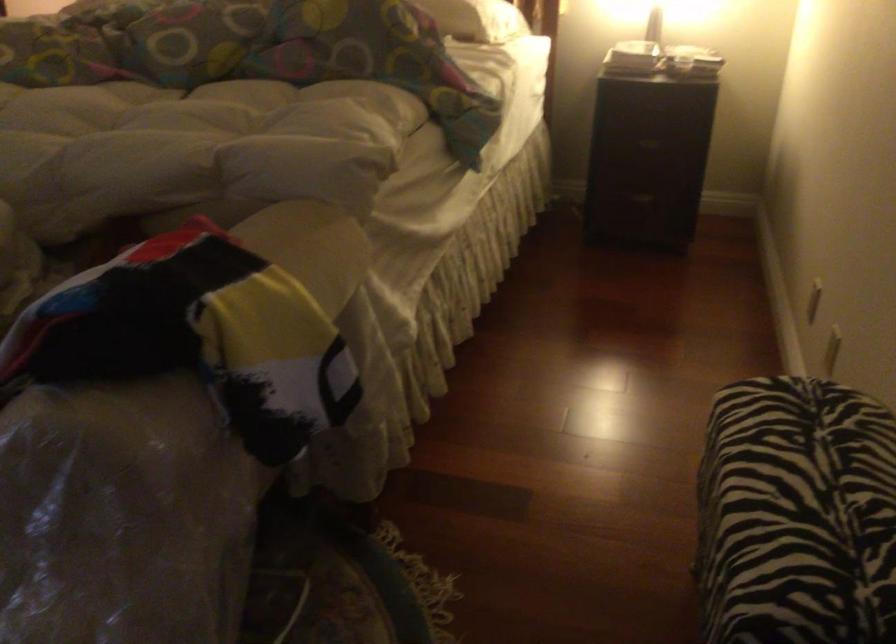
Where would you pull the drawer handle? Please return your answer as a coordinate pair (x, y).

(650, 140)